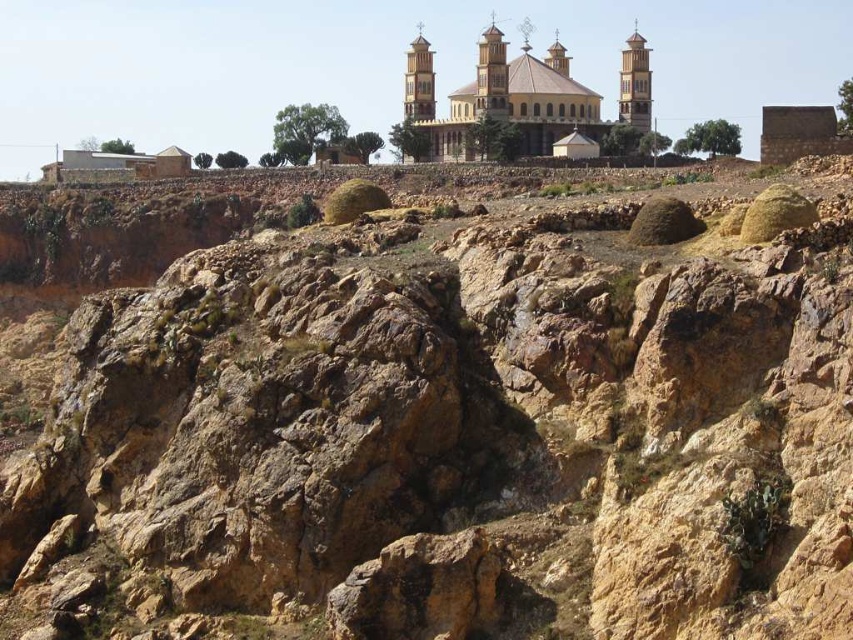
Is golden stone church at upper center thinner than wooden tower at upper right?

No.

Does golden stone church at upper center have a larger size compared to wooden tower at upper right?

Indeed, golden stone church at upper center has a larger size compared to wooden tower at upper right.

This screenshot has width=853, height=640. What are the coordinates of `golden stone church at upper center` in the screenshot? It's located at (498, 99).

Identify the location of golden stone church at upper center. (498, 99).